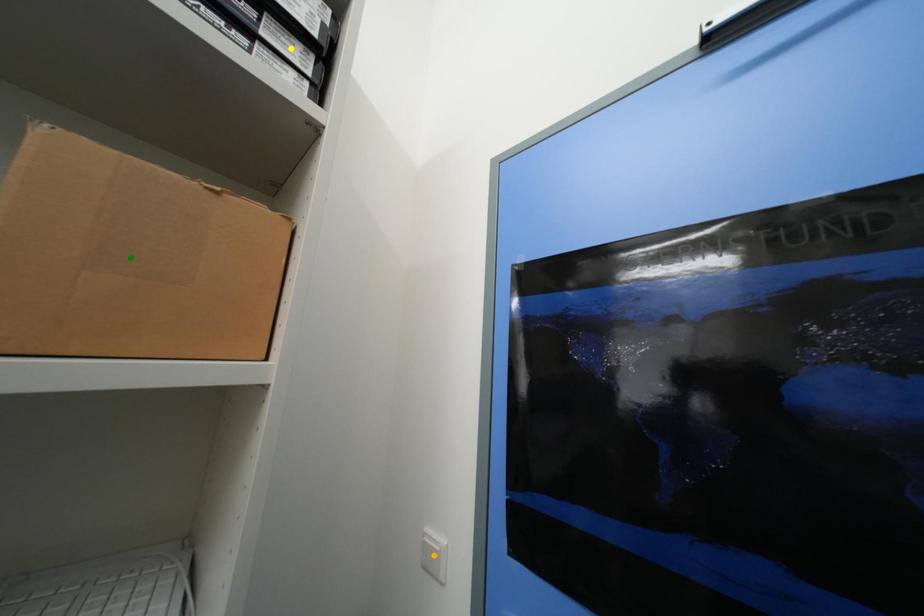
Order these from nearest to farthest:
green point
orange point
yellow point

green point → yellow point → orange point